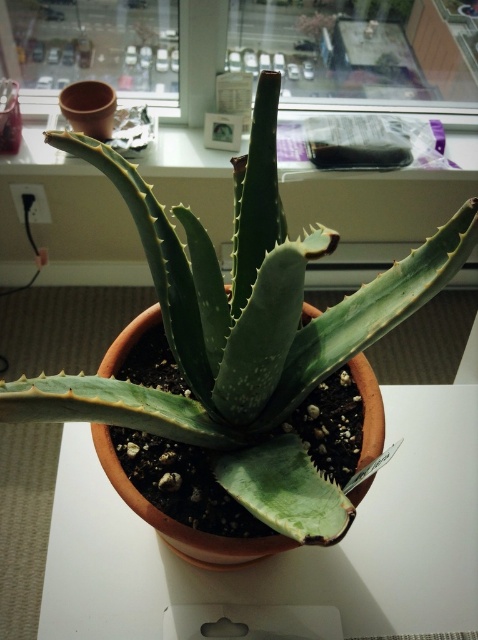
Does white matte table at center have a greater width compared to matte glass window at upper center?

Indeed, white matte table at center has a greater width compared to matte glass window at upper center.

Does white matte table at center come in front of matte glass window at upper center?

That is True.

Image resolution: width=478 pixels, height=640 pixels. Describe the element at coordinates (292, 548) in the screenshot. I see `white matte table at center` at that location.

The height and width of the screenshot is (640, 478). I want to click on white matte table at center, so click(x=292, y=548).

In the scene shown: Who is taller, transparent plastic bag at upper center or matte glass window at upper center?

matte glass window at upper center

The height and width of the screenshot is (640, 478). I want to click on transparent plastic bag at upper center, so click(x=358, y=45).

What are the coordinates of `transparent plastic bag at upper center` in the screenshot? It's located at (358, 45).

Does white matte table at center have a greater width compared to transparent plastic bag at upper center?

Indeed, white matte table at center has a greater width compared to transparent plastic bag at upper center.

Can you confirm if white matte table at center is positioned below transparent plastic bag at upper center?

Indeed, white matte table at center is positioned under transparent plastic bag at upper center.

Image resolution: width=478 pixels, height=640 pixels. Describe the element at coordinates (292, 548) in the screenshot. I see `white matte table at center` at that location.

Where is `white matte table at center`? This screenshot has width=478, height=640. white matte table at center is located at coordinates (292, 548).